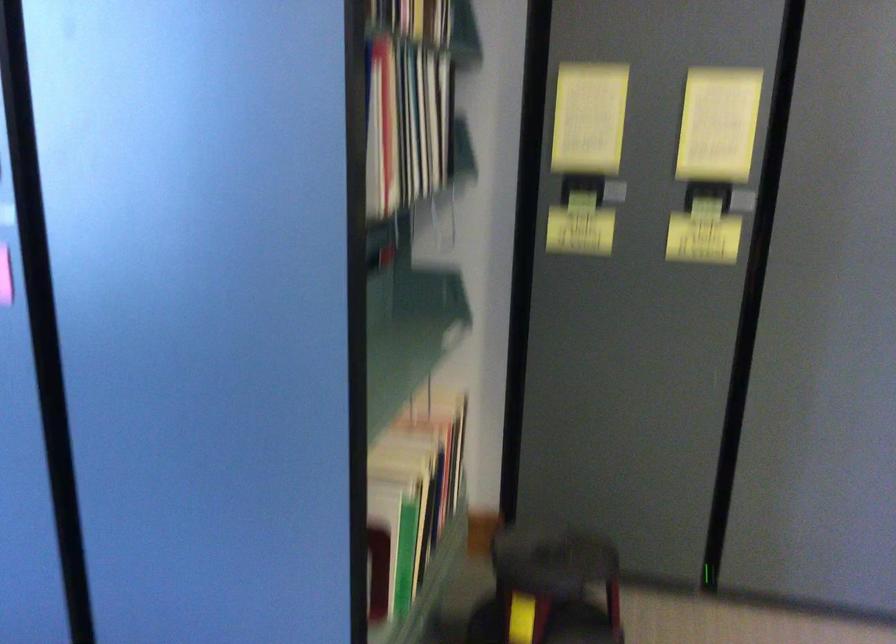
Locate an element on the screen. chair sitting surface is located at coordinates coord(552,558).